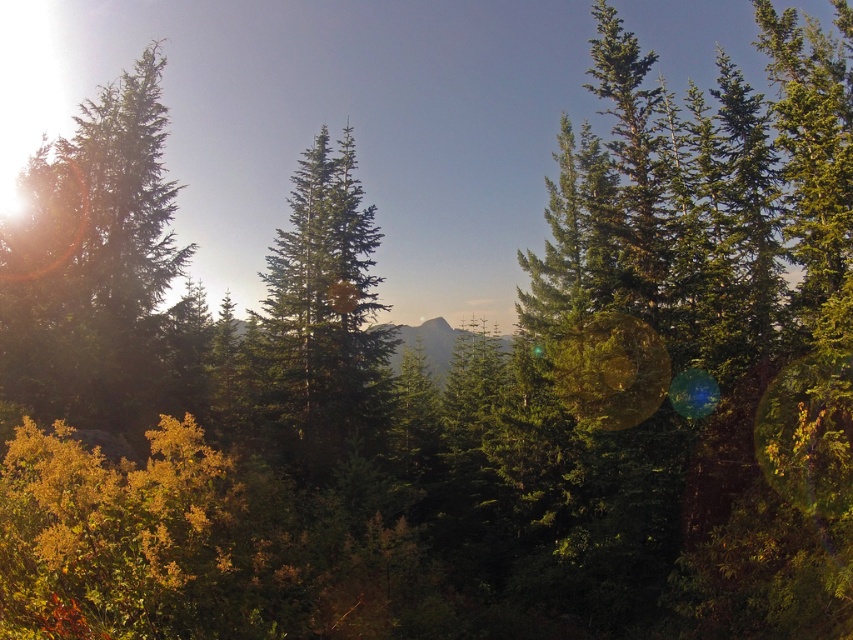
How distant is green matte tree at left from green textured mountain at center?

green matte tree at left and green textured mountain at center are 47.90 meters apart from each other.

Does green matte tree at left appear on the left side of green textured mountain at center?

Yes, green matte tree at left is to the left of green textured mountain at center.

Locate an element on the screen. This screenshot has width=853, height=640. green matte tree at left is located at coordinates (102, 273).

What do you see at coordinates (318, 321) in the screenshot? This screenshot has width=853, height=640. I see `green needle-like tree at center` at bounding box center [318, 321].

Which is below, green needle-like tree at center or green textured mountain at center?

green textured mountain at center is lower down.

I want to click on green needle-like tree at center, so click(318, 321).

Describe the element at coordinates (102, 273) in the screenshot. I see `green matte tree at left` at that location.

Between point (51, 209) and point (341, 390), which one is positioned in front?

Point (51, 209)

Find the location of `green matte tree at left`. green matte tree at left is located at coordinates (102, 273).